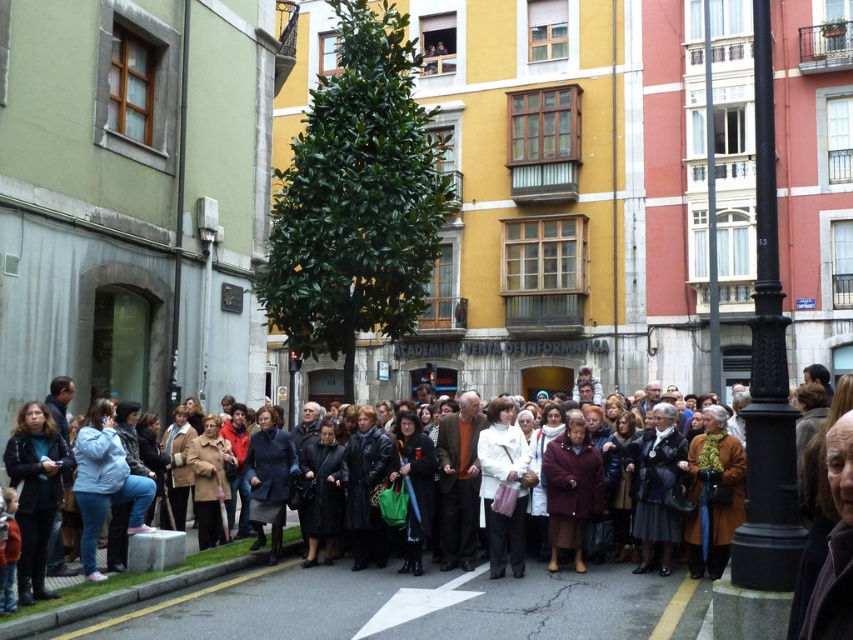
Question: Which object is positioned closest to the white matte coat at center?

Choices:
 (A) dark blue wool coat at center
 (B) black metal pole at right
 (C) dark brown leather coat at center
 (D) maroon wool coat at center

Answer: (D)

Question: Is black metal pole at right in front of dark blue wool coat at center?

Choices:
 (A) yes
 (B) no

Answer: (A)

Question: Which point is farther to the camera?

Choices:
 (A) white matte coat at center
 (B) maroon wool coat at center

Answer: (B)

Question: Is dark brown leather coat at center closer to camera compared to black metal pole at right?

Choices:
 (A) no
 (B) yes

Answer: (B)

Question: Estimate the real-world distances between objects in this image. Which object is farther from the dark brown leather coat at center?

Choices:
 (A) maroon wool coat at center
 (B) black metal pole at right
 (C) white matte coat at center
 (D) dark blue wool coat at center

Answer: (B)

Question: Does maroon wool coat at center have a greater width compared to dark blue wool coat at center?

Choices:
 (A) yes
 (B) no

Answer: (B)